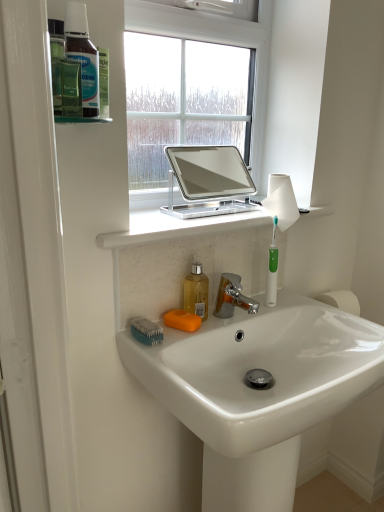
At what (x,y) coordinates should I click in order to perform the action: click on vacant area located to the right-hand side of teal plastic brush at lower left. Please return your answer as a coordinate pair (x, y). Looking at the image, I should click on (205, 328).